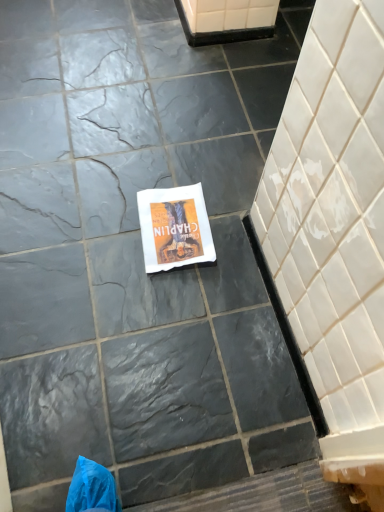
Image resolution: width=384 pixels, height=512 pixels. Find the location of `vacant space situated on the left part of white paper towel at center`. vacant space situated on the left part of white paper towel at center is located at coordinates (96, 219).